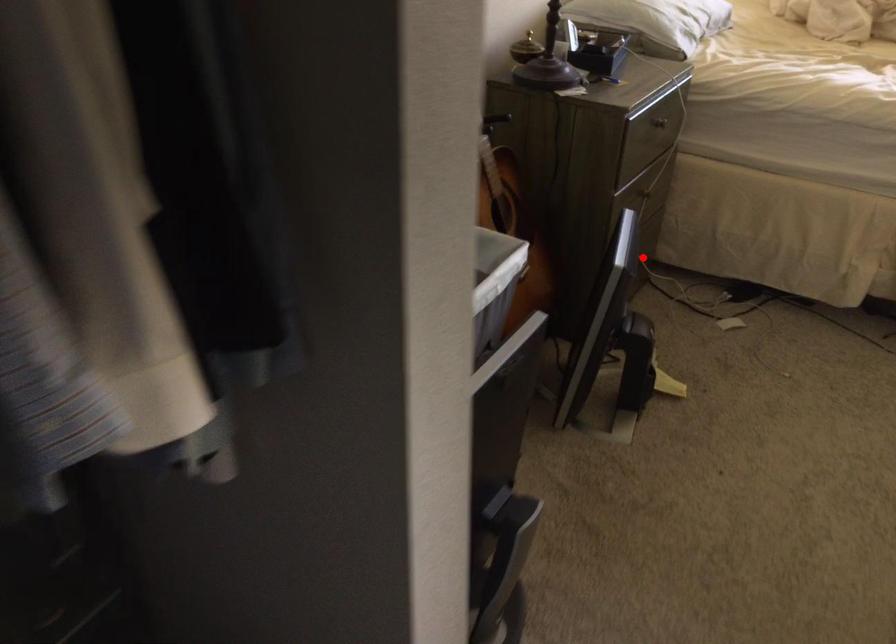
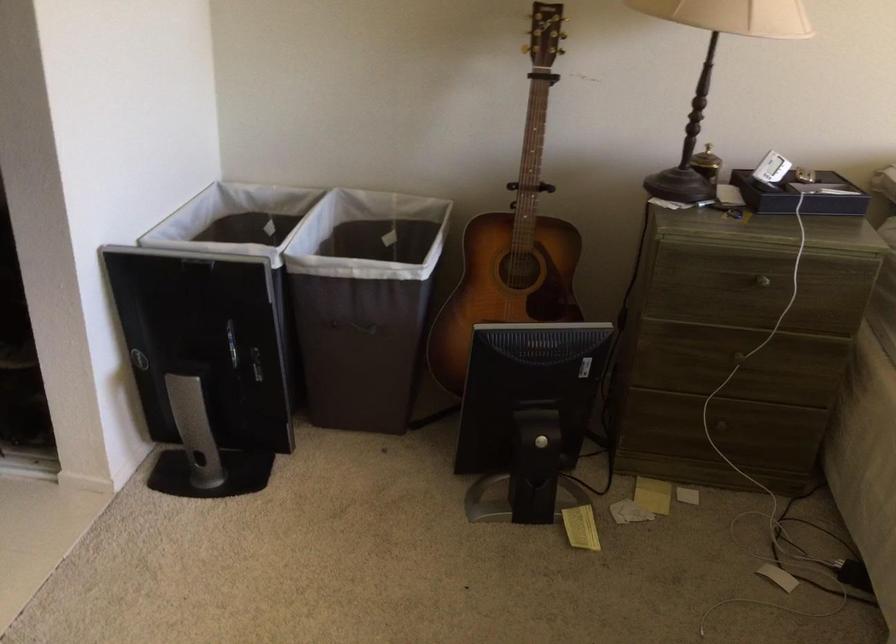
Question: I am providing you with two images of the same scene from different viewpoints. Image1 has a red point marked. In image2, the corresponding 3D location appears at what relative position? Reply with the corresponding letter.

Choices:
 (A) Closer
 (B) Farther

Answer: (A)